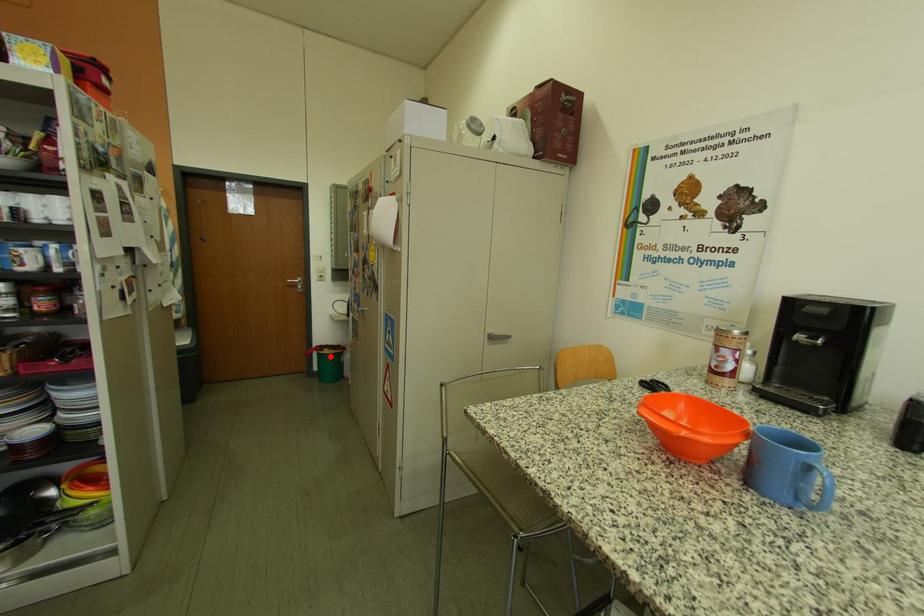
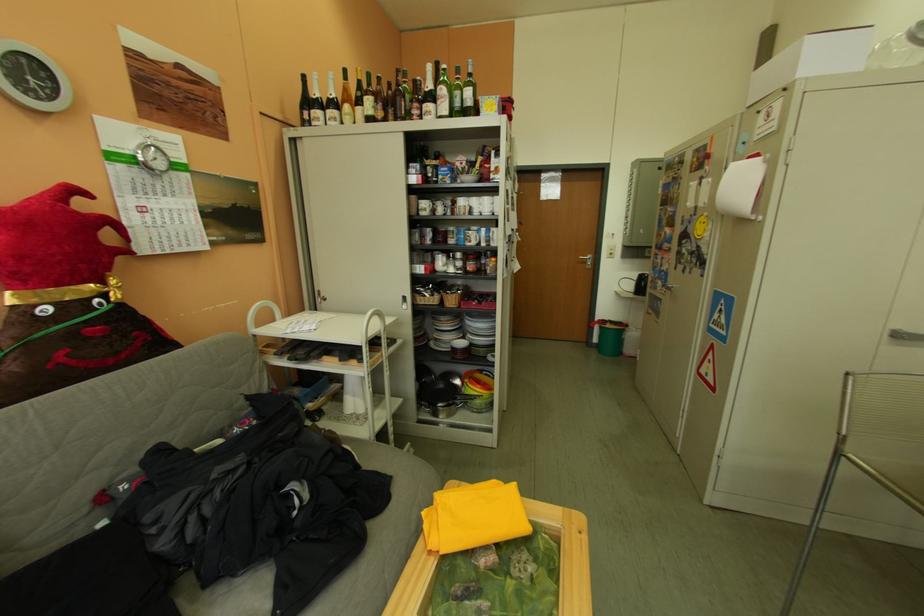
Question: A red point is marked in image1. In image2, is the corresponding 3D point closer to the camera or farther? Reply with the corresponding letter.

Choices:
 (A) The corresponding 3D point is closer.
 (B) The corresponding 3D point is farther.

Answer: (A)